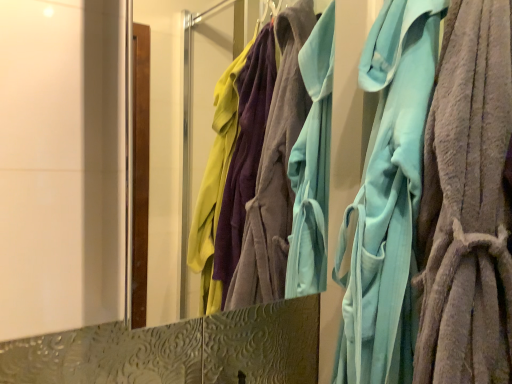
This screenshot has height=384, width=512. In order to click on teal soft towel at center in this screenshot , I will do `click(387, 198)`.

Describe the element at coordinates (387, 198) in the screenshot. I see `teal soft towel at center` at that location.

This screenshot has width=512, height=384. I want to click on teal soft towel at center, so click(x=387, y=198).